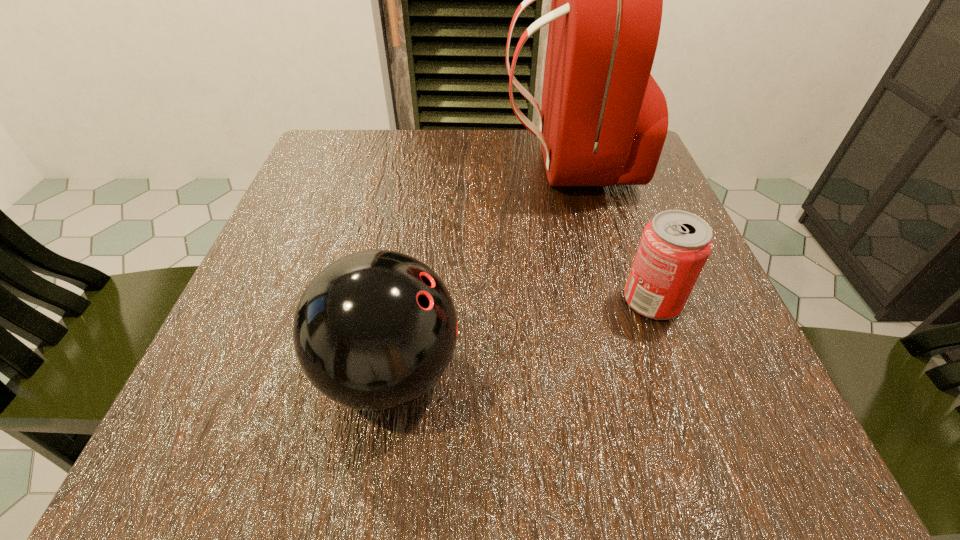
Find the location of a particular element. free space between the leftmost object and the tallest object is located at coordinates (478, 268).

Locate an element on the screen. The image size is (960, 540). vacant region between the soda can and the bowling ball is located at coordinates [521, 336].

Where is `vacant point located between the shortest object and the second tallest object`? The image size is (960, 540). vacant point located between the shortest object and the second tallest object is located at coordinates (521, 336).

You are a GUI agent. You are given a task and a screenshot of the screen. Output one action in this format:
    pyautogui.click(x=<x>, y=<y>)
    Task: Click on the object that is the closest to the second shortest object
    Image resolution: width=960 pixels, height=540 pixels.
    Given the screenshot: What is the action you would take?
    pyautogui.click(x=675, y=245)

Locate which object ranks second in proximity to the soda can. Please provide its 2D coordinates. Your answer should be formatted as a tuple, i.e. [(x, y)], where the tuple contains the x and y coordinates of a point satisfying the conditions above.

[(374, 330)]

The height and width of the screenshot is (540, 960). Identify the location of vacant position in the image that satisfies the following two spatial constraints: 1. on the strap side of the tallest object; 2. on the left side of the soda can. (602, 300).

Where is `free point that satisfies the following two spatial constraints: 1. on the strap side of the soda can; 2. on the left side of the backpack`? The height and width of the screenshot is (540, 960). free point that satisfies the following two spatial constraints: 1. on the strap side of the soda can; 2. on the left side of the backpack is located at coordinates (602, 300).

You are a GUI agent. You are given a task and a screenshot of the screen. Output one action in this format:
    pyautogui.click(x=<x>, y=<y>)
    Task: Click on the free space in the image that satisfies the following two spatial constraints: 1. on the strap side of the shortest object; 2. on the right side of the tallest object
    The height and width of the screenshot is (540, 960).
    Given the screenshot: What is the action you would take?
    pyautogui.click(x=602, y=300)

Identify the location of free region that satisfies the following two spatial constraints: 1. on the strap side of the shortest object; 2. on the right side of the farthest object. This screenshot has height=540, width=960. (602, 300).

You are a GUI agent. You are given a task and a screenshot of the screen. Output one action in this format:
    pyautogui.click(x=<x>, y=<y>)
    Task: Click on the free location that satisfies the following two spatial constraints: 1. on the strap side of the soda can; 2. on the right side of the tallest object
    
    Given the screenshot: What is the action you would take?
    pyautogui.click(x=602, y=300)